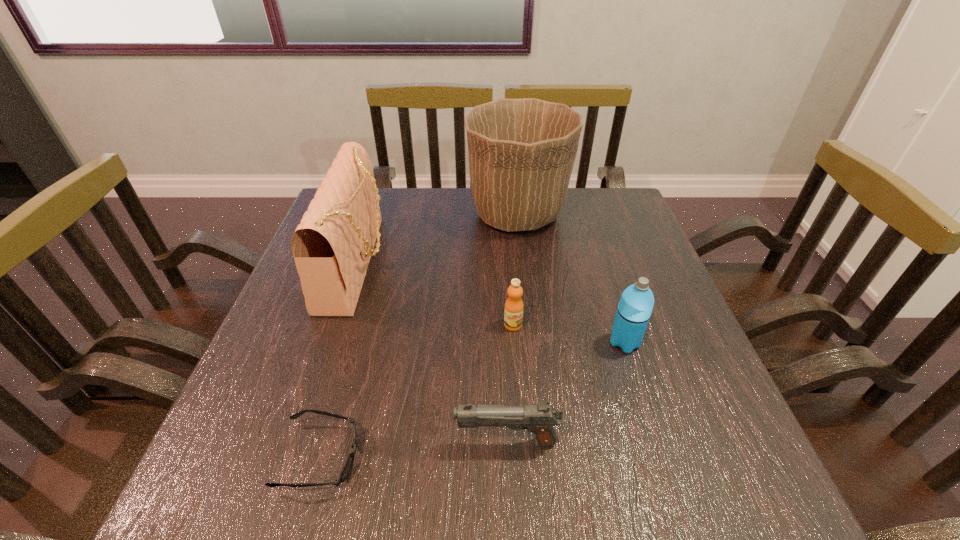
Identify the location of unoccupied area between the thermos bottle and the orange juice. Image resolution: width=960 pixels, height=540 pixels. (568, 334).

This screenshot has height=540, width=960. Find the location of `free point between the shortest object and the second tallest object`. free point between the shortest object and the second tallest object is located at coordinates (339, 360).

Where is `free space between the gun and the rightmost object`? The width and height of the screenshot is (960, 540). free space between the gun and the rightmost object is located at coordinates (565, 392).

Locate an element on the screen. The width and height of the screenshot is (960, 540). free space between the fifth shortest object and the gun is located at coordinates 432,352.

The image size is (960, 540). I want to click on unoccupied position between the tallest object and the handbag, so click(x=437, y=238).

Identify the location of empty space that is in between the thermos bottle and the handbag. Image resolution: width=960 pixels, height=540 pixels. (491, 302).

Find the location of a particular element. This screenshot has width=960, height=540. free space that is in between the sunglasses and the second tallest object is located at coordinates (339, 360).

This screenshot has width=960, height=540. Identify the location of empty space that is in between the handbag and the rightmost object. (491, 302).

Find the location of a particular element. The height and width of the screenshot is (540, 960). vacant point located between the sunglasses and the gun is located at coordinates (414, 449).

The width and height of the screenshot is (960, 540). Find the location of `object that is the fifth closest to the shortest object`. object that is the fifth closest to the shortest object is located at coordinates (521, 152).